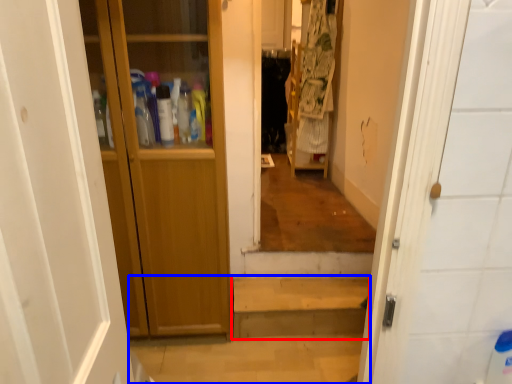
Question: Which object appears farthest to the camera in this image, stairwell (highlighted by a red box) or path (highlighted by a blue box)?

Choices:
 (A) stairwell
 (B) path

Answer: (A)